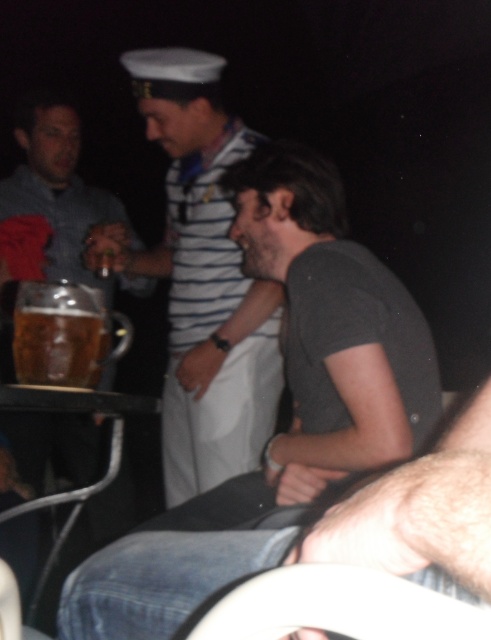
Question: Which point is closer to the camera taking this photo?

Choices:
 (A) (198, 342)
 (B) (22, 346)
 (C) (416, 384)

Answer: (B)

Question: Which is nearer to the striped sailor shirt at center?

Choices:
 (A) translucent glass mug at center
 (B) dark gray t-shirt at center

Answer: (B)

Question: Which point is farther from the camera taking this photo?

Choices:
 (A) (86, 384)
 (B) (219, 401)

Answer: (B)

Question: Does dark gray t-shirt at center appear under translucent glass mug at center?

Choices:
 (A) yes
 (B) no

Answer: (A)

Question: Is dark gray t-shirt at center bigger than striped sailor shirt at center?

Choices:
 (A) no
 (B) yes

Answer: (B)

Question: In this image, where is dark gray t-shirt at center located relative to striped sailor shirt at center?

Choices:
 (A) below
 (B) above

Answer: (A)